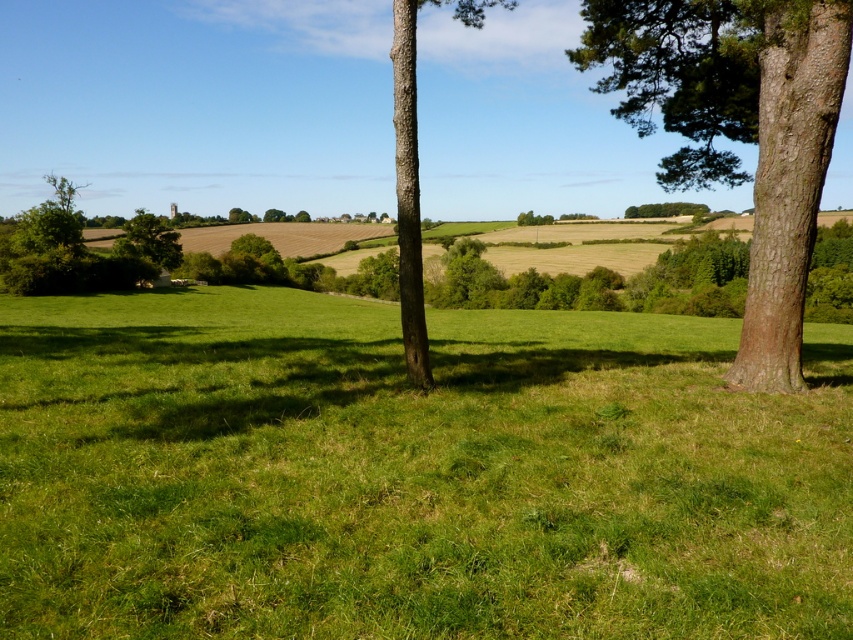
Question: Among these points, which one is nearest to the camera?

Choices:
 (A) (125, 240)
 (B) (641, 212)

Answer: (A)

Question: Can you confirm if brown rough bark tree at center is positioned to the right of green leafy tree at upper center?

Choices:
 (A) no
 (B) yes

Answer: (A)

Question: Which point is closer to the camera?

Choices:
 (A) (155, 234)
 (B) (682, 212)
 (C) (498, 364)

Answer: (C)

Question: Estimate the real-world distances between objects in this image. Which object is closer to the green leafy tree at left?

Choices:
 (A) brown rough bark tree at right
 (B) brown rough bark tree at center

Answer: (B)

Question: Does brown rough bark tree at right have a larger size compared to green leafy tree at left?

Choices:
 (A) no
 (B) yes

Answer: (A)

Question: Does green leafy tree at left appear on the left side of green leafy tree at upper center?

Choices:
 (A) no
 (B) yes

Answer: (B)